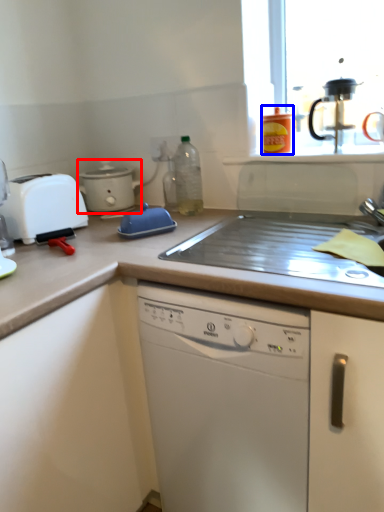
Question: Which object appears farthest to the camera in this image, kitchen appliance (highlighted by a red box) or kitchen appliance (highlighted by a blue box)?

Choices:
 (A) kitchen appliance
 (B) kitchen appliance

Answer: (A)